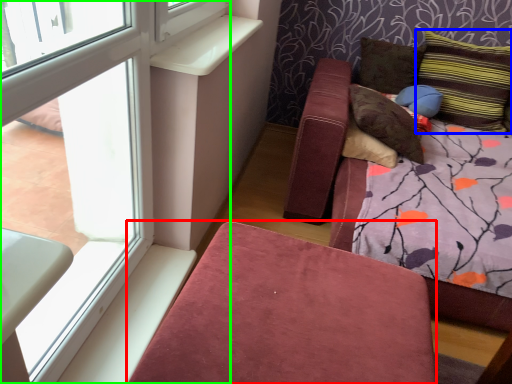
Question: Based on their relative distances, which object is nearer to furniture (highlighted by a red box)? Choose from pillow (highlighted by a blue box) and window (highlighted by a green box).

Choices:
 (A) pillow
 (B) window

Answer: (B)